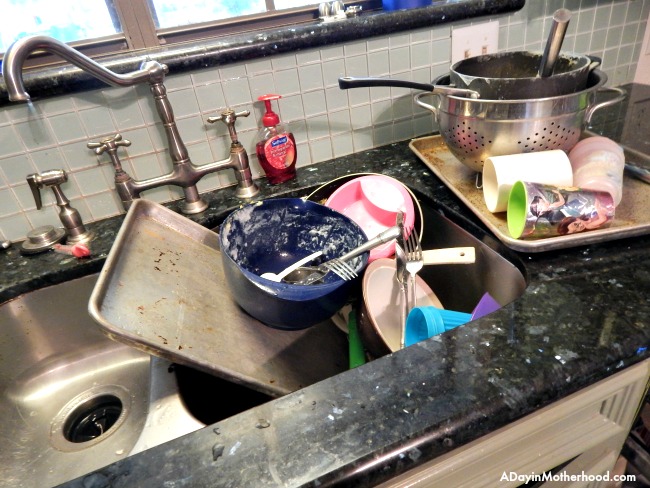
What are the coordinates of `soap` in the screenshot? It's located at (268, 153).